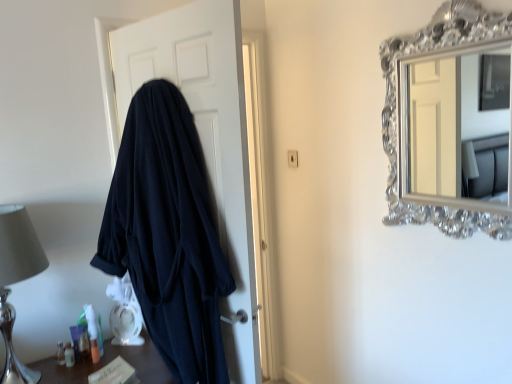
Question: Considering the relative positions of silver metallic table lamp at left and translucent plastic tube at lower left, positioned as the 1th toiletry in right-to-left order, in the image provided, is silver metallic table lamp at left in front of translucent plastic tube at lower left, positioned as the 1th toiletry in right-to-left order,?

Choices:
 (A) no
 (B) yes

Answer: (B)

Question: Is silver metallic table lamp at left smaller than translucent plastic tube at lower left, acting as the second toiletry starting from the left?

Choices:
 (A) no
 (B) yes

Answer: (A)

Question: Is silver metallic table lamp at left not within translucent plastic tube at lower left, positioned as the 1th toiletry in right-to-left order?

Choices:
 (A) yes
 (B) no

Answer: (A)

Question: Can you confirm if silver metallic table lamp at left is bigger than translucent plastic tube at lower left, acting as the second toiletry starting from the left?

Choices:
 (A) yes
 (B) no

Answer: (A)

Question: Is silver metallic table lamp at left oriented away from translucent plastic tube at lower left, positioned as the 1th toiletry in right-to-left order?

Choices:
 (A) yes
 (B) no

Answer: (B)

Question: Considering the positions of point (137, 367) and point (96, 355), is point (137, 367) closer or farther from the camera than point (96, 355)?

Choices:
 (A) closer
 (B) farther

Answer: (A)

Question: Looking at their shapes, would you say translucent plastic toiletries at lower left is wider or thinner than translucent plastic tube at lower left, positioned as the 1th toiletry in right-to-left order?

Choices:
 (A) wide
 (B) thin

Answer: (A)

Question: Is translucent plastic toiletries at lower left spatially inside translucent plastic tube at lower left, positioned as the 1th toiletry in right-to-left order, or outside of it?

Choices:
 (A) outside
 (B) inside

Answer: (A)

Question: In terms of height, does translucent plastic toiletries at lower left look taller or shorter compared to translucent plastic tube at lower left, positioned as the 1th toiletry in right-to-left order?

Choices:
 (A) short
 (B) tall

Answer: (B)

Question: Is point (68, 350) positioned closer to the camera than point (2, 284)?

Choices:
 (A) farther
 (B) closer

Answer: (A)

Question: Looking at their shapes, would you say translucent plastic container at lower left, the first toiletry from the left, is wider or thinner than silver metallic table lamp at left?

Choices:
 (A) thin
 (B) wide

Answer: (A)

Question: Considering the relative positions of translucent plastic container at lower left, the 2th toiletry positioned from the right, and silver metallic table lamp at left in the image provided, is translucent plastic container at lower left, the 2th toiletry positioned from the right, to the left or to the right of silver metallic table lamp at left?

Choices:
 (A) left
 (B) right

Answer: (B)

Question: Relative to silver metallic table lamp at left, is translucent plastic container at lower left, the 2th toiletry positioned from the right, in front or behind?

Choices:
 (A) front
 (B) behind

Answer: (B)

Question: In terms of width, does translucent plastic toiletries at lower left look wider or thinner when compared to silver metallic table lamp at left?

Choices:
 (A) thin
 (B) wide

Answer: (B)

Question: Would you say translucent plastic toiletries at lower left is to the left or to the right of silver metallic table lamp at left in the picture?

Choices:
 (A) right
 (B) left

Answer: (A)